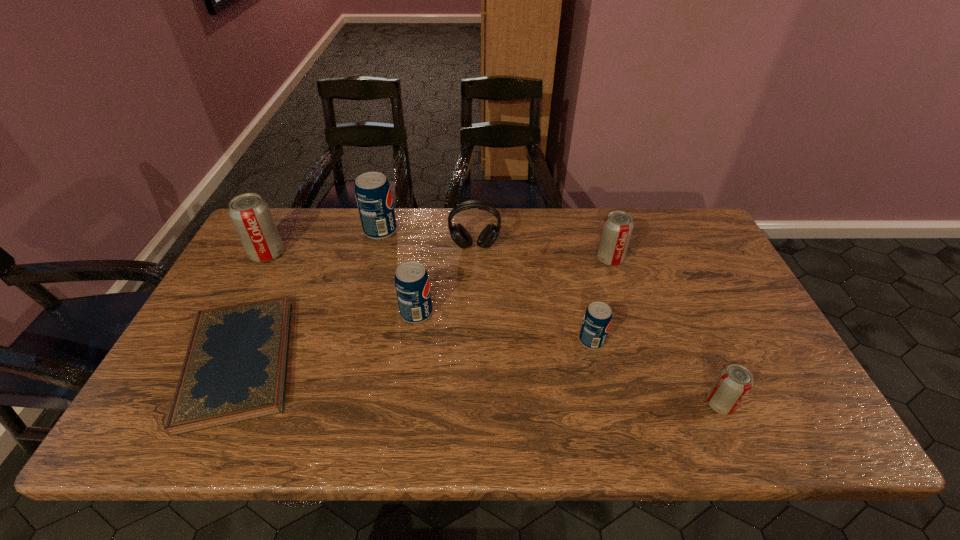
You are a GUI agent. You are given a task and a screenshot of the screen. Output one action in this format:
    pyautogui.click(x=<x>, y=<y>)
    Task: Click on the free space at the far edge of the desktop
    
    Given the screenshot: What is the action you would take?
    pyautogui.click(x=416, y=245)

You are a GUI agent. You are given a task and a screenshot of the screen. Output one action in this format:
    pyautogui.click(x=<x>, y=<y>)
    Task: Click on the vacant point at the near edge
    The image size is (960, 540).
    Given the screenshot: What is the action you would take?
    pyautogui.click(x=725, y=435)

What are the coordinates of `free space at the right edge of the desktop` in the screenshot? It's located at (709, 266).

Identify the location of vacant region at the far left corner of the desktop. (296, 220).

Identify the location of vacant space at the far right corner of the desktop. Image resolution: width=960 pixels, height=540 pixels. (692, 235).

Image resolution: width=960 pixels, height=540 pixels. In order to click on vacant space at the near right corner of the desktop in this screenshot , I will do `click(797, 430)`.

Identify the location of empty space between the paperback book and the gray headset. (357, 304).

Where is `free space between the rightmost soda can and the biggest gray soda can`? The height and width of the screenshot is (540, 960). free space between the rightmost soda can and the biggest gray soda can is located at coordinates (493, 329).

Locate an element on the screen. The height and width of the screenshot is (540, 960). free space between the second gray soda can from right to left and the rightmost blue pop is located at coordinates (601, 300).

Locate an element on the screen. free space between the biggest blue pop and the paperback book is located at coordinates (310, 296).